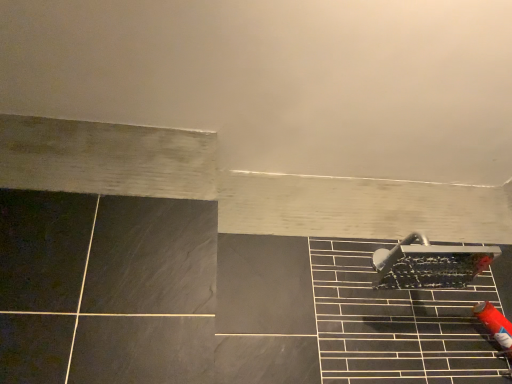
The width and height of the screenshot is (512, 384). I want to click on empty space that is ontop of matte black tile at lower right (from a real-world perspective), so click(392, 243).